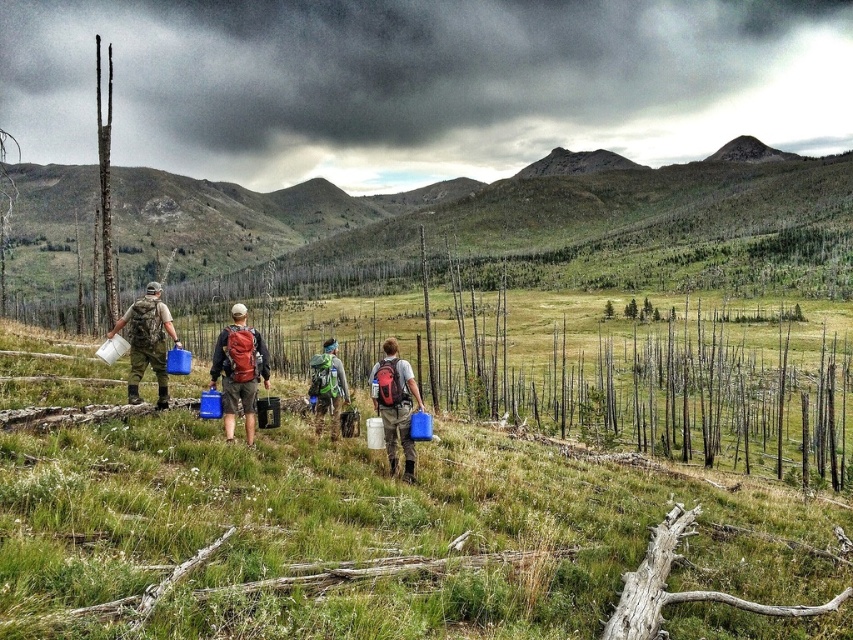
Does point (699, 115) come behind point (334, 371)?

That is True.

Consider the image. Does dark gray cloud at upper center have a greater width compared to green fabric backpack at center?

Yes.

Image resolution: width=853 pixels, height=640 pixels. What do you see at coordinates (421, 83) in the screenshot?
I see `dark gray cloud at upper center` at bounding box center [421, 83].

Where is `dark gray cloud at upper center`? The height and width of the screenshot is (640, 853). dark gray cloud at upper center is located at coordinates pyautogui.click(x=421, y=83).

Describe the element at coordinates (239, 371) in the screenshot. I see `matte red backpack at center` at that location.

Can you confirm if matte red backpack at center is shorter than smooth brown tree trunk at left?

Yes.

Who is more distant from viewer, (245, 385) or (103, 150)?

The point (103, 150) is more distant.

Locate an element on the screen. The height and width of the screenshot is (640, 853). matte red backpack at center is located at coordinates (239, 371).

Can you confirm if smooth brown tree trunk at left is thinner than green fabric backpack at center?

No.

What do you see at coordinates (105, 182) in the screenshot? The image size is (853, 640). I see `smooth brown tree trunk at left` at bounding box center [105, 182].

This screenshot has width=853, height=640. What are the coordinates of `smooth brown tree trunk at left` in the screenshot? It's located at (x=105, y=182).